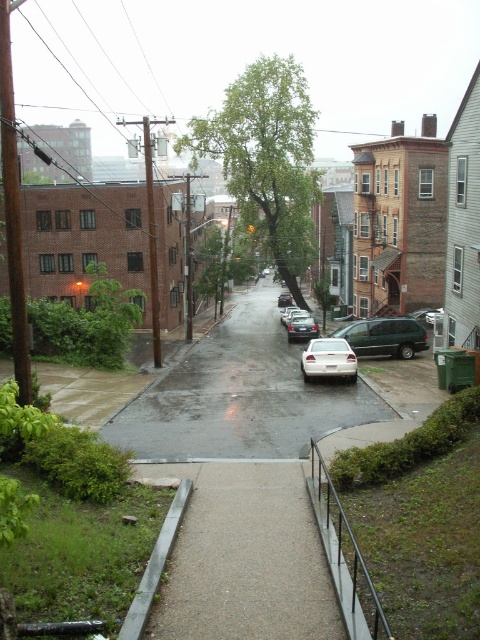
Based on the scene description, where is the wet asphalt road at center located in terms of its 2D coordinates?

The wet asphalt road at center is located at the 2D coordinates of point (240, 396).

You are a pedestrian trying to avoid getting wet in the rain. You see the wet asphalt road at center and the green leafy tree at center. Which one is higher up and can provide shelter from the rain?

The green leafy tree at center is higher up than the wet asphalt road at center, so it can provide shelter from the rain.